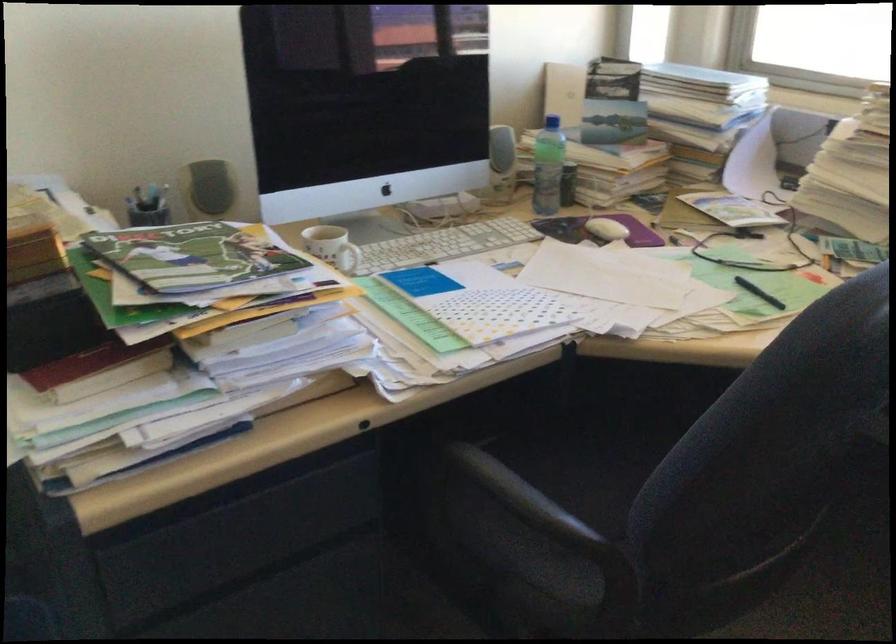
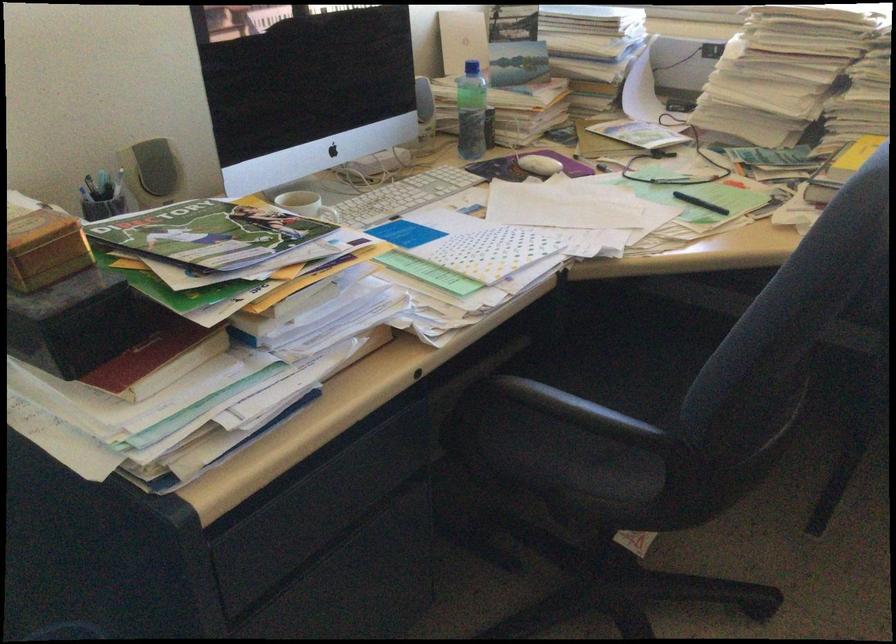
Where in the second image is the point corresponding to (211,525) from the first image?

(300, 491)